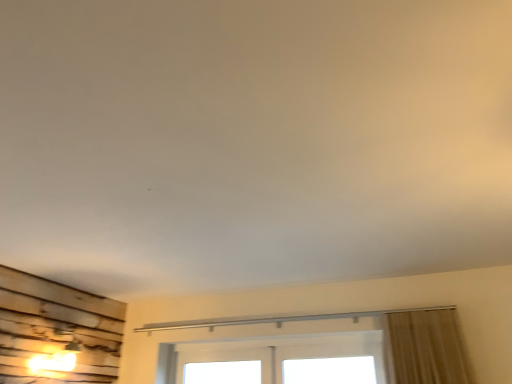
What do you see at coordinates (287, 353) in the screenshot?
I see `white plastic window at center` at bounding box center [287, 353].

In the scene shown: What is the approximate height of white plastic window at center?

13.00 inches.

Where is `white plastic window at center`? The height and width of the screenshot is (384, 512). white plastic window at center is located at coordinates (287, 353).

You are a GUI agent. You are given a task and a screenshot of the screen. Output one action in this format:
    pyautogui.click(x=<x>, y=<y>)
    Task: Click on the white plastic window at center
    The image size is (512, 384).
    Given the screenshot: What is the action you would take?
    pyautogui.click(x=287, y=353)